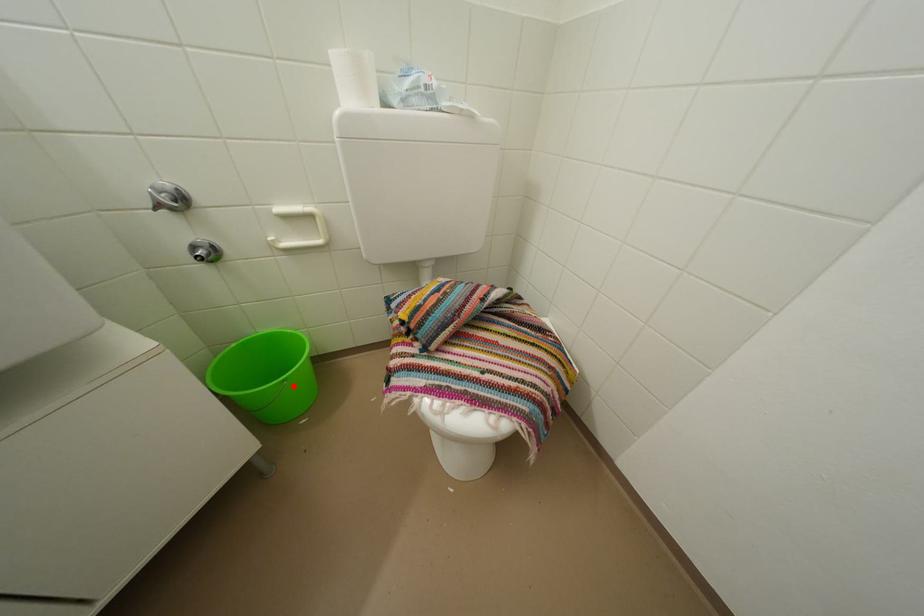
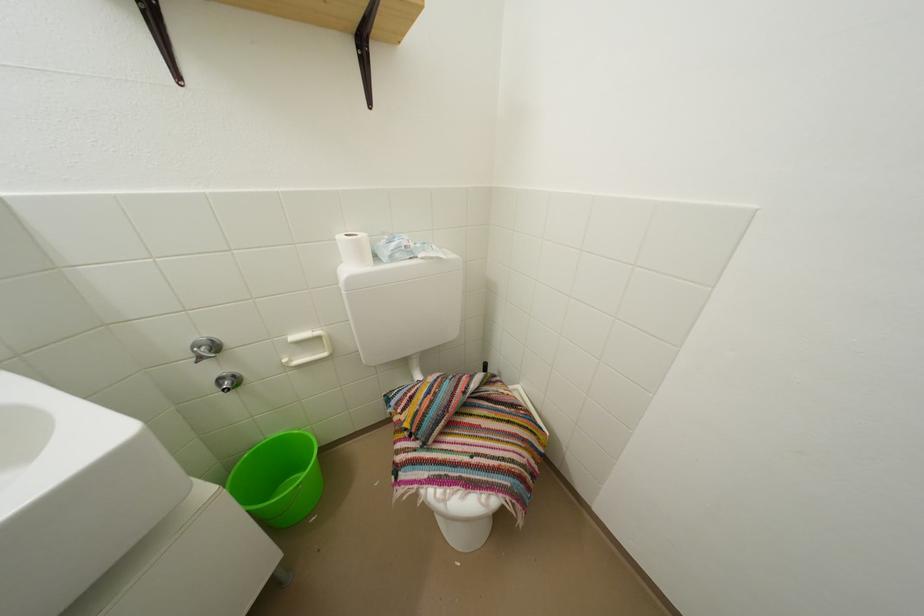
Locate, in the second image, the point that corresponds to the highlighted location in the first image.

(309, 491)